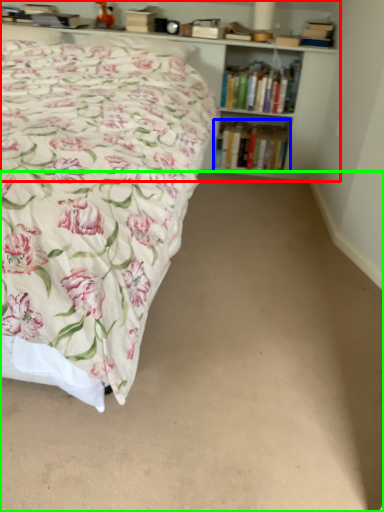
Question: Considering the real-world distances, which object is closest to bookcase (highlighted by a red box)? book (highlighted by a blue box) or plain (highlighted by a green box).

Choices:
 (A) book
 (B) plain

Answer: (A)